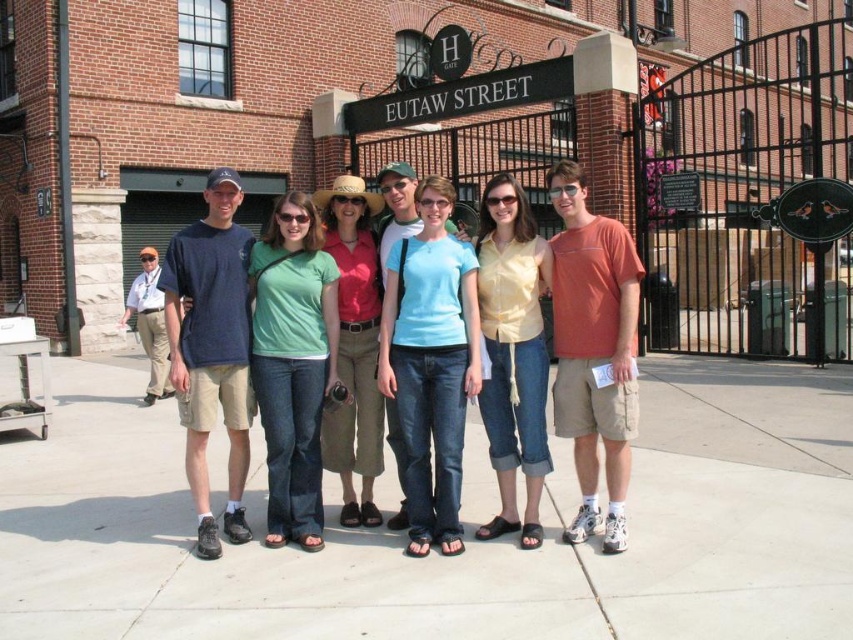
Question: Estimate the real-world distances between objects in this image. Which object is farther from the light gray concrete pavement at center?

Choices:
 (A) light blue denim jeans at center
 (B) khaki pants at left
 (C) matte blue shirt at center
 (D) yellow cotton shirt at center

Answer: (B)

Question: Is green matte shirt at center positioned in front of dark blue t-shirt at left?

Choices:
 (A) yes
 (B) no

Answer: (B)

Question: Can you confirm if light gray concrete pavement at center is bigger than orange cotton shirt at center?

Choices:
 (A) no
 (B) yes

Answer: (B)

Question: Can you confirm if light gray concrete pavement at center is smaller than green matte shirt at center?

Choices:
 (A) no
 (B) yes

Answer: (A)

Question: Which point is farther to the camera?

Choices:
 (A) (312, 291)
 (B) (839, 563)

Answer: (A)

Question: Which of the following is the closest to the observer?

Choices:
 (A) dark blue t-shirt at left
 (B) matte pink shirt at center
 (C) green matte shirt at center

Answer: (A)